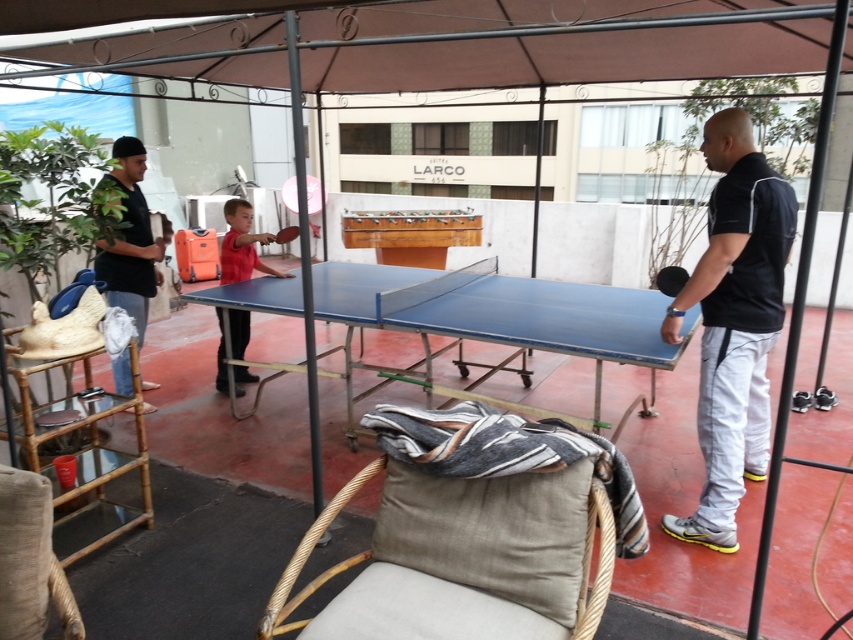
Which is above, black matte shirt at left or blue plastic table tennis table at center?

blue plastic table tennis table at center is above.

Is point (126, 355) in front of point (282, 230)?

Yes, it is in front of point (282, 230).

Where is `black matte shirt at left`? The image size is (853, 640). black matte shirt at left is located at coordinates (131, 240).

Is point (401, 289) farther from camera compared to point (611, 452)?

Yes, it is.

From the picture: Is blue rubber table at center smaller than beige fabric cushion at lower center?

Incorrect, blue rubber table at center is not smaller in size than beige fabric cushion at lower center.

Does point (466, 291) come behind point (421, 413)?

That is True.

Find the location of a particular element. The image size is (853, 640). blue rubber table at center is located at coordinates (494, 326).

How much distance is there between black matte shirt at left and black rubber table tennis table at right?

2.34 meters

Which is more to the right, black matte shirt at left or black rubber table tennis table at right?

From the viewer's perspective, black rubber table tennis table at right appears more on the right side.

At what (x,y) coordinates should I click in order to perform the action: click on black matte shirt at left. Please return your answer as a coordinate pair (x, y). The height and width of the screenshot is (640, 853). Looking at the image, I should click on (131, 240).